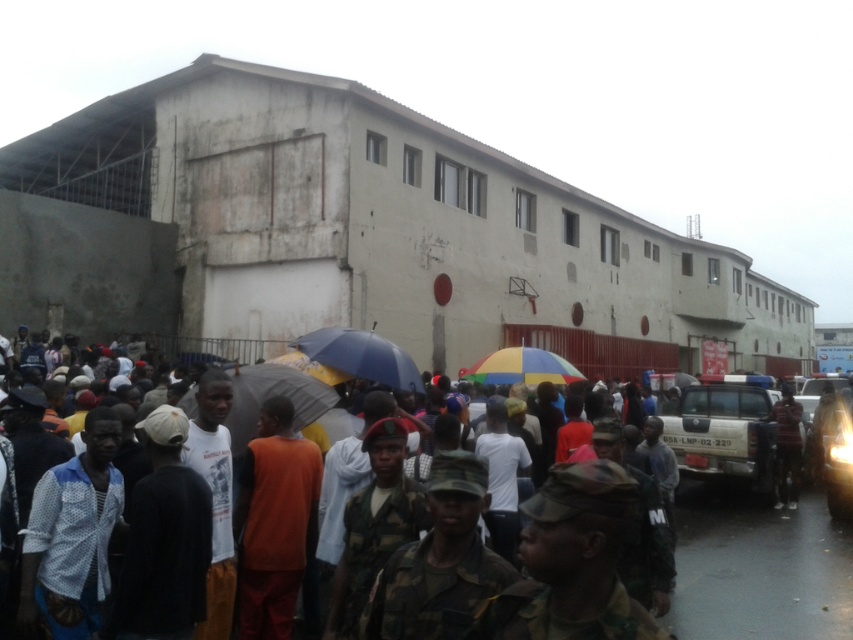
Question: Which of the following is the closest to the observer?

Choices:
 (A) (550, 358)
 (B) (300, 467)
 (C) (347, 353)

Answer: (B)

Question: Is the position of white dotted shirt at center less distant than that of blue matte umbrella at center?

Choices:
 (A) no
 (B) yes

Answer: (B)

Question: Considering the real-world distances, which object is farthest from the orange fabric shirt at center?

Choices:
 (A) rainbow fabric umbrella at center
 (B) white dotted shirt at center
 (C) camouflage uniform at center
 (D) blue matte umbrella at center

Answer: (A)

Question: Can you confirm if blue matte umbrella at center is wider than rainbow fabric umbrella at center?

Choices:
 (A) no
 (B) yes

Answer: (A)

Question: Based on their relative distances, which object is farther from the camouflage uniform at center?

Choices:
 (A) blue matte umbrella at center
 (B) orange fabric shirt at center
 (C) rainbow fabric umbrella at center

Answer: (C)

Question: Can you confirm if camouflage uniform at center is positioned below white dotted shirt at center?

Choices:
 (A) yes
 (B) no

Answer: (A)